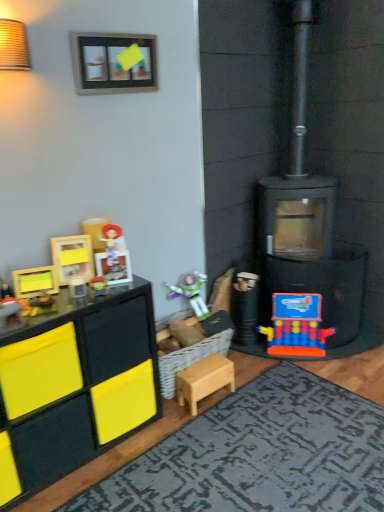
Question: From their relative heights in the image, would you say wooden picture frame at upper center is taller or shorter than black matte fireplace at right?

Choices:
 (A) tall
 (B) short

Answer: (B)

Question: From a real-world perspective, is wooden picture frame at upper center physically located above or below black matte fireplace at right?

Choices:
 (A) below
 (B) above

Answer: (B)

Question: Which is nearer to the textured gray rug at lower center?

Choices:
 (A) light wood stool at center, which is counted as the 4th toy, starting from the front
 (B) yellow fabric drawer at left
 (C) wooden photo frame at upper left, marked as the third toy in a right-to-left arrangement
 (D) matte black toy at left, arranged as the 1th toy when viewed from the left
 (E) yellow matte toy at left, the fourth toy viewed from the back

Answer: (A)

Question: Which object is positioned closest to the light wood stool at center, which is the 4th toy from left to right?

Choices:
 (A) matte black toy at left, arranged as the 5th toy when viewed from the back
 (B) yellow matte toy at left, which appears as the fourth toy when viewed from the right
 (C) wooden picture frame at upper center
 (D) textured gray rug at lower center
 (E) black matte fireplace at right

Answer: (D)